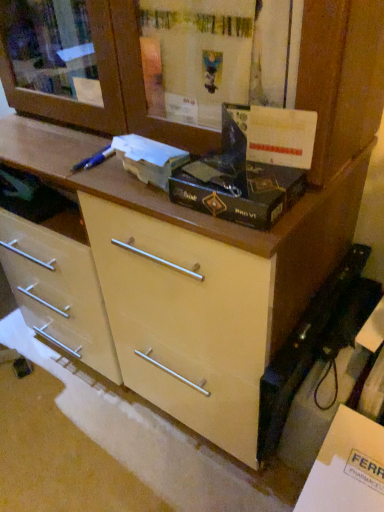
Where is `empty space that is ontop of white matte cabinet at lower right`? The height and width of the screenshot is (512, 384). empty space that is ontop of white matte cabinet at lower right is located at coordinates (345, 462).